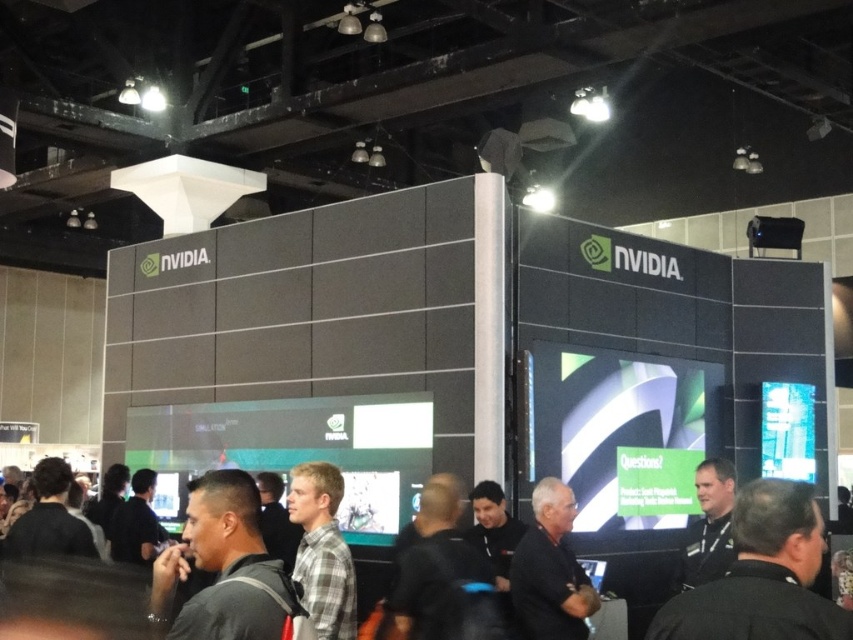
Question: Which object appears farthest from the camera in this image?

Choices:
 (A) black shirt at center
 (B) dark gray shirt at center
 (C) black uniform at center

Answer: (A)

Question: Which point appears farthest from the camera in this image?

Choices:
 (A) (189, 636)
 (B) (554, 596)
 (C) (772, 512)

Answer: (B)

Question: Is dark gray shirt at center further to the viewer compared to black shirt at center?

Choices:
 (A) yes
 (B) no

Answer: (B)

Question: Which of these objects is positioned farthest from the black uniform at center?

Choices:
 (A) black shirt at center
 (B) dark gray shirt at center

Answer: (A)

Question: Does black uniform at center appear over black shirt at center?

Choices:
 (A) no
 (B) yes

Answer: (B)

Question: Does black uniform at center appear over dark gray shirt at center?

Choices:
 (A) no
 (B) yes

Answer: (B)